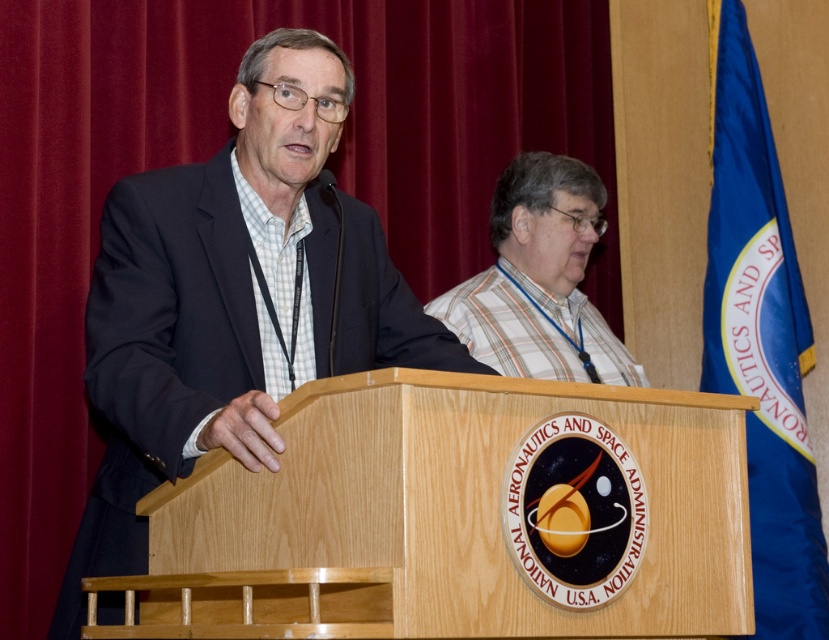
You are a photographer standing in front of the velvet red curtain at upper left and need to position a camera so that it is exactly 2.61 meters away from the curtain. Where should you place the camera?

The velvet red curtain at upper left and the camera are 2.61 meters apart, so you should place the camera 2.61 meters away from the velvet red curtain at upper left to capture the scene properly.